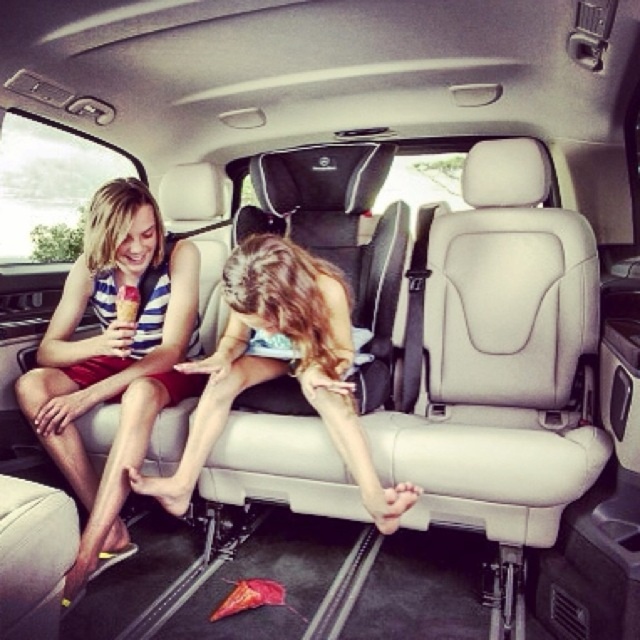
You are a photographer taking a picture of the matte striped tank top at left and the matte skin girl at center. Which object appears narrower in the photo?

The matte striped tank top at left appears narrower than the matte skin girl at center in the photo.

You are a passenger in the car and want to hand a snack to the matte skin girl at center. Which direction should you move to reach her from the matte striped tank top at left?

The matte skin girl at center is behind the matte striped tank top at left, so you should move backward to reach her.